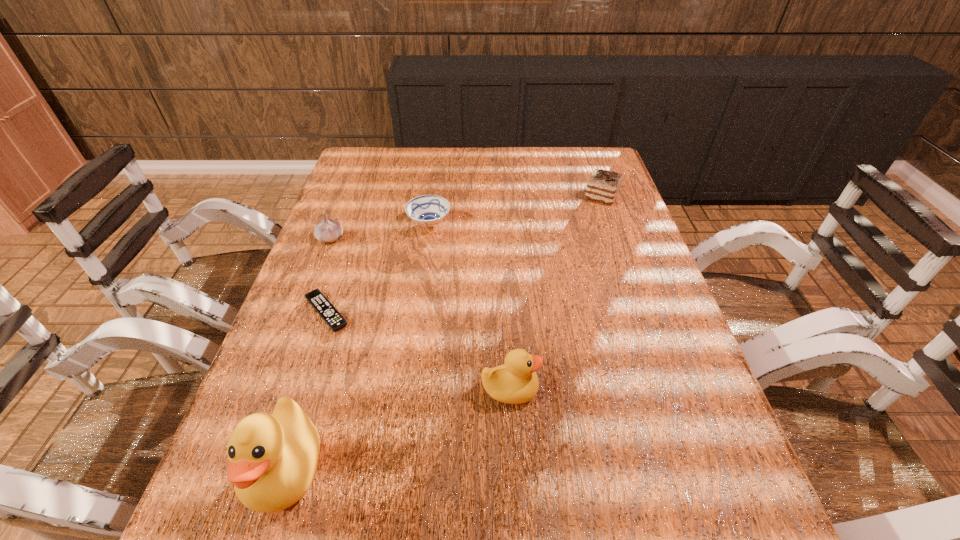
Where is `garlic`? This screenshot has height=540, width=960. garlic is located at coordinates (328, 230).

In order to click on free location located 0.060m at the beak of the right duck in this screenshot , I will do `click(568, 390)`.

I want to click on vacant region located 0.310m on the front of the chocolate cake, so click(631, 278).

This screenshot has height=540, width=960. Identify the location of vacant position located 0.140m on the right of the soup bowl. (499, 224).

In order to click on vacant space located 0.160m on the back of the shortest object in this screenshot , I will do `click(348, 249)`.

Locate an element on the screen. The image size is (960, 540). vacant space located 0.150m on the right of the garlic is located at coordinates (398, 238).

Locate an element on the screen. Image resolution: width=960 pixels, height=540 pixels. object at the near edge is located at coordinates (272, 459).

At what (x,y) coordinates should I click in order to perform the action: click on duck located at the left edge. Please return your answer as a coordinate pair (x, y). The image size is (960, 540). Looking at the image, I should click on (272, 459).

You are a GUI agent. You are given a task and a screenshot of the screen. Output one action in this format:
    pyautogui.click(x=<x>, y=<y>)
    Task: Click on the remote control present at the left edge
    Image resolution: width=960 pixels, height=540 pixels.
    Given the screenshot: What is the action you would take?
    pyautogui.click(x=316, y=298)

The image size is (960, 540). Find the location of `garlic that is at the left edge`. garlic that is at the left edge is located at coordinates (328, 230).